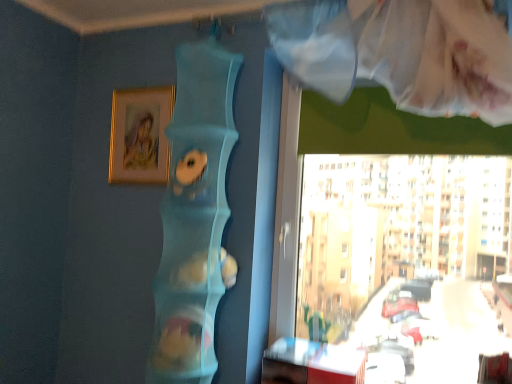
Question: From the image's perspective, is gold metallic picture frame at upper left positioned above or below wooden table at lower right?

Choices:
 (A) below
 (B) above

Answer: (B)

Question: From a real-world perspective, relative to wooden table at lower right, is gold metallic picture frame at upper left vertically above or below?

Choices:
 (A) above
 (B) below

Answer: (A)

Question: Is gold metallic picture frame at upper left inside or outside of wooden table at lower right?

Choices:
 (A) inside
 (B) outside

Answer: (B)

Question: Is wooden table at lower right wider or thinner than gold metallic picture frame at upper left?

Choices:
 (A) thin
 (B) wide

Answer: (B)

Question: Is wooden table at lower right spatially inside gold metallic picture frame at upper left, or outside of it?

Choices:
 (A) inside
 (B) outside

Answer: (B)

Question: Considering the positions of wooden table at lower right and gold metallic picture frame at upper left in the image, is wooden table at lower right taller or shorter than gold metallic picture frame at upper left?

Choices:
 (A) tall
 (B) short

Answer: (B)

Question: Considering the relative positions of wooden table at lower right and gold metallic picture frame at upper left in the image provided, is wooden table at lower right to the left or to the right of gold metallic picture frame at upper left?

Choices:
 (A) right
 (B) left

Answer: (A)